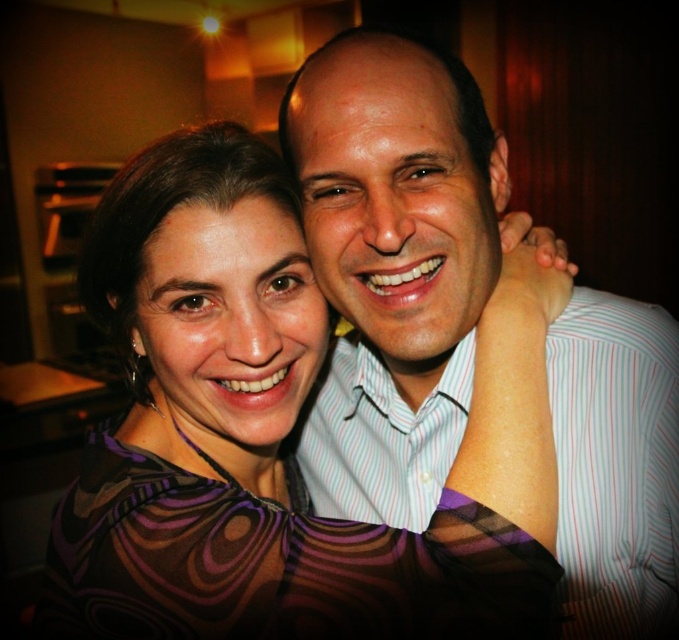
Describe the element at coordinates (257, 438) in the screenshot. I see `patterned fabric dress at center` at that location.

Who is more forward, (151, 321) or (409, 108)?

Point (409, 108) is in front.

Image resolution: width=679 pixels, height=640 pixels. Find the location of `patterned fabric dress at center`. patterned fabric dress at center is located at coordinates (257, 438).